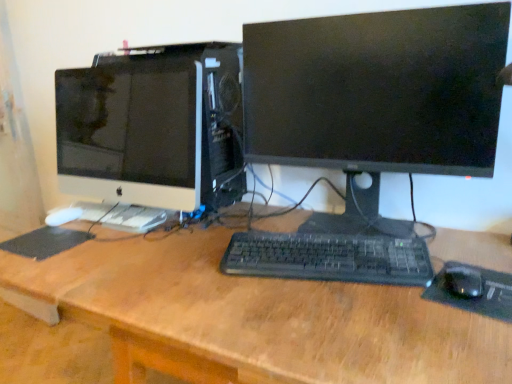
The width and height of the screenshot is (512, 384). In order to click on vacant space that is in between black plastic keyboard at center and black rubber mousepad at lower right, which is the first mousepad from right to left in this screenshot , I will do `click(370, 290)`.